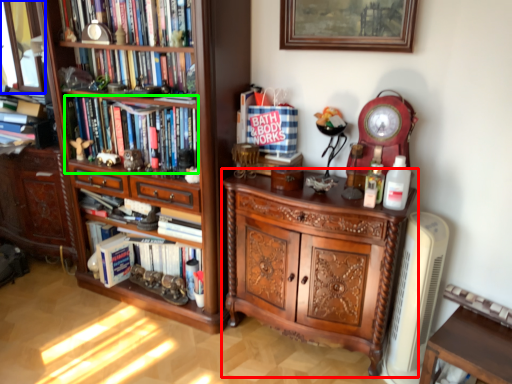
Question: Based on their relative distances, which object is farther from chest of drawers (highlighted by a red box)? Choose from glass door (highlighted by a blue box) and book (highlighted by a green box).

Choices:
 (A) glass door
 (B) book

Answer: (A)